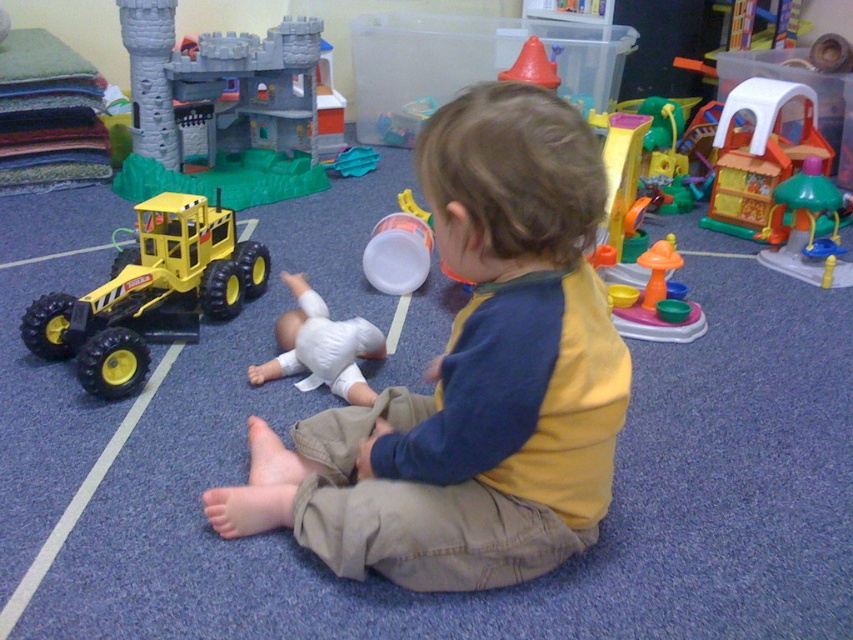
Question: Based on their relative distances, which object is farther from the green plastic playhouse at right?

Choices:
 (A) plastic playhouse at center
 (B) smooth orange cone at upper center
 (C) white matte baby doll at center
 (D) yellow cotton shirt at center

Answer: (D)

Question: Which object is farther from the camera taking this photo?

Choices:
 (A) green plastic playhouse at right
 (B) white matte baby doll at center
 (C) yellow matte toy car at left
 (D) yellow cotton shirt at center

Answer: (A)

Question: Is yellow matte toy car at left closer to the viewer compared to white matte baby doll at center?

Choices:
 (A) no
 (B) yes

Answer: (B)

Question: Which object is farther from the camera taking this photo?

Choices:
 (A) yellow matte toy car at left
 (B) white matte baby doll at center
 (C) multicolored plastic playset at center
 (D) yellow cotton shirt at center

Answer: (C)

Question: From the image, what is the correct spatial relationship of white matte baby doll at center in relation to green plastic playhouse at right?

Choices:
 (A) below
 (B) above

Answer: (A)

Question: Is white matte baby doll at center further to the viewer compared to multicolored plastic playset at center?

Choices:
 (A) yes
 (B) no

Answer: (B)